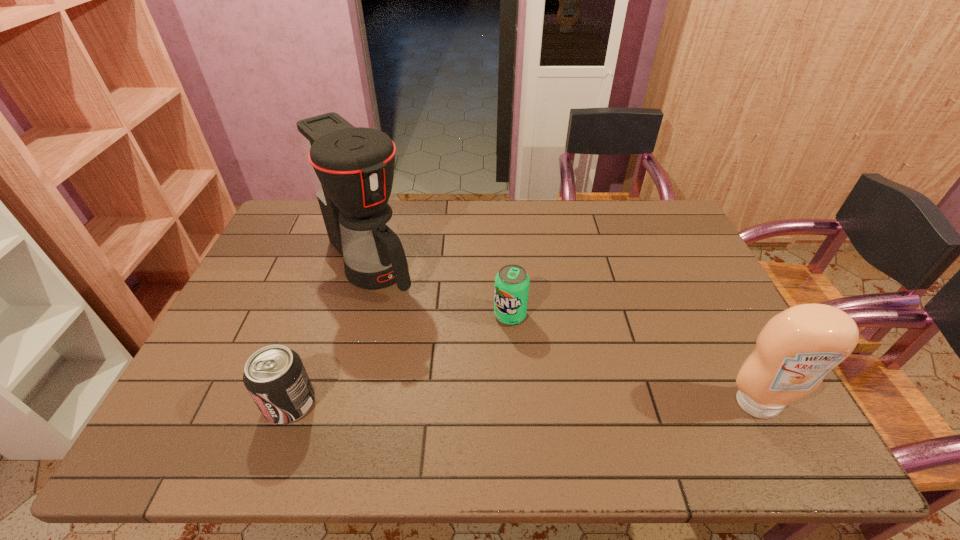
You are a GUI agent. You are given a task and a screenshot of the screen. Output one action in this format:
    pyautogui.click(x=<x>, y=<y>)
    Task: Click on the vacant area located on the front-facing side of the third object from left to right
    
    Given the screenshot: What is the action you would take?
    pyautogui.click(x=488, y=363)

Where is `vacant point located 0.080m on the front-facing side of the third object from left to right`? The height and width of the screenshot is (540, 960). vacant point located 0.080m on the front-facing side of the third object from left to right is located at coordinates (494, 349).

In order to click on free space located on the front-facing side of the third object from left to right in this screenshot , I will do `click(478, 382)`.

Where is `object present at the far edge`? The width and height of the screenshot is (960, 540). object present at the far edge is located at coordinates (352, 168).

Find the location of a particular element. soda can that is at the near edge is located at coordinates (275, 377).

Find the location of `condiment situated at the near edge`. condiment situated at the near edge is located at coordinates (796, 349).

Where is `object at the right edge`? The width and height of the screenshot is (960, 540). object at the right edge is located at coordinates (796, 349).

Find the location of a particular element. The height and width of the screenshot is (540, 960). object located in the near right corner section of the desktop is located at coordinates (796, 349).

In order to click on vacant area at the far edge in this screenshot , I will do `click(572, 230)`.

The width and height of the screenshot is (960, 540). I want to click on free region at the left edge of the desktop, so click(x=241, y=355).